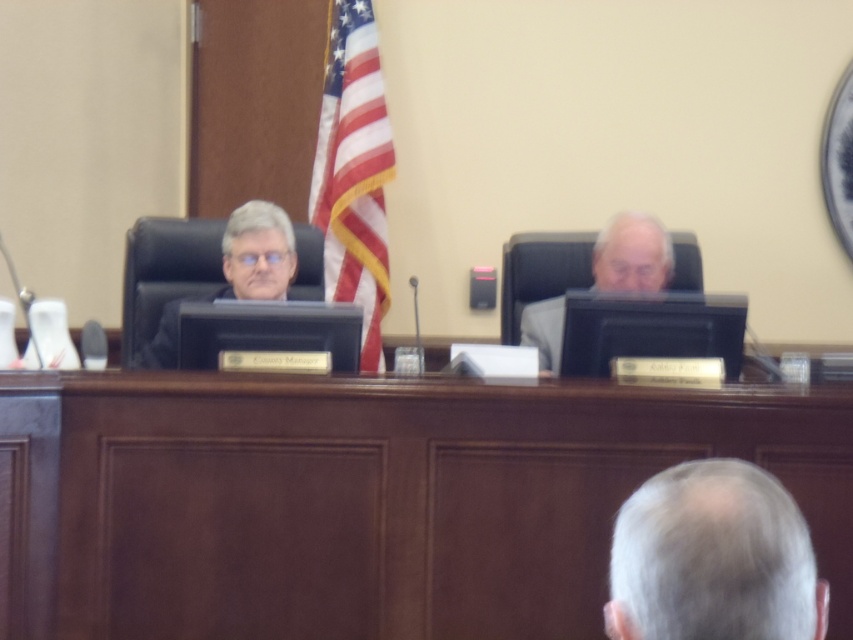
Question: Considering the relative positions of gray hair at lower right and gray fabric chair at center in the image provided, where is gray hair at lower right located with respect to gray fabric chair at center?

Choices:
 (A) above
 (B) below

Answer: (B)

Question: Can you confirm if brown wood table at center is positioned to the left of matte black chair at left?

Choices:
 (A) yes
 (B) no

Answer: (B)

Question: Is gray hair at lower right above matte black chair at left?

Choices:
 (A) yes
 (B) no

Answer: (B)

Question: Among these points, which one is nearest to the camera?

Choices:
 (A) (656, 474)
 (B) (357, 125)
 (C) (817, 560)

Answer: (A)

Question: Based on their relative distances, which object is nearer to the american flag at center?

Choices:
 (A) brown wood table at center
 (B) matte black chair at left

Answer: (B)

Question: Among these objects, which one is nearest to the camera?

Choices:
 (A) matte black chair at left
 (B) american flag at center
 (C) brown wood table at center

Answer: (C)